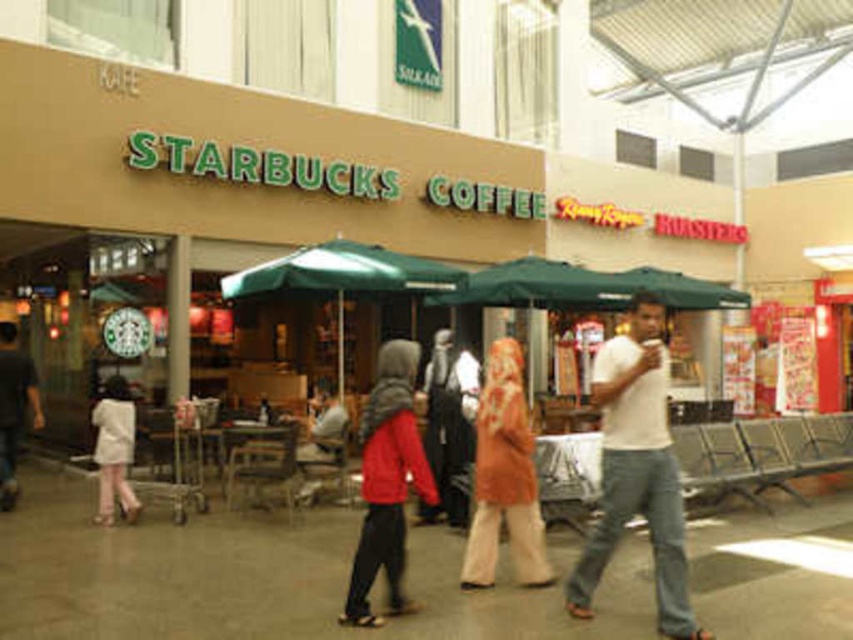
You are a customer in the shopping area and you want to find the red matte jacket at center. According to the coordinates provided, where should you look relative to the Starbucks Coffee shop?

The red matte jacket at center is located at coordinates point (387, 483), which is to the right side of the Starbucks Coffee shop.

You are a customer looking for the HUNTERS store. You see the red matte jacket at center and the green fabric canopy at center. Which object is closer to you?

The red matte jacket at center is closer to the viewer than the green fabric canopy at center.